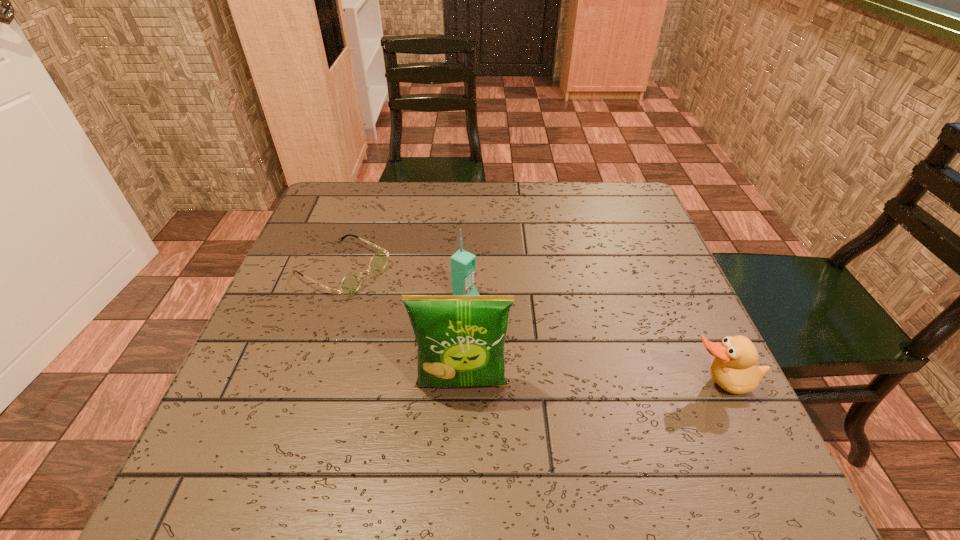
The height and width of the screenshot is (540, 960). What are the coordinates of `free point located 0.330m on the lenses of the spectacles` in the screenshot? It's located at (501, 355).

Find the location of a particular element. free location located on the lenses of the spectacles is located at coordinates (415, 308).

Locate an element on the screen. vacant space located 0.300m on the lenses of the spectacles is located at coordinates (489, 348).

Identify the location of crisp (potato chip) located at the near edge. (460, 339).

This screenshot has width=960, height=540. What are the coordinates of `duck located at the near edge` in the screenshot? It's located at (733, 369).

Identify the location of object located in the left edge section of the desktop. (351, 283).

Image resolution: width=960 pixels, height=540 pixels. What are the coordinates of `object at the right edge` in the screenshot? It's located at (733, 369).

Identify the location of object present at the near right corner. Image resolution: width=960 pixels, height=540 pixels. (733, 369).

Where is `free space at the far edge of the desktop`? Image resolution: width=960 pixels, height=540 pixels. free space at the far edge of the desktop is located at coordinates (390, 207).

Identify the location of vacant region at the near edge of the desktop. Image resolution: width=960 pixels, height=540 pixels. (432, 413).